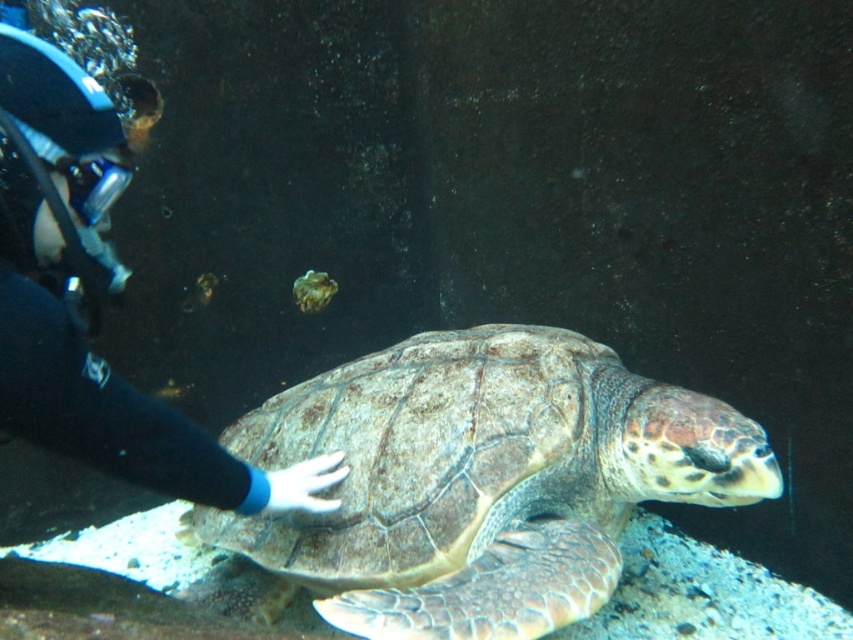
You are a marine biologist studying the movements of underwater creatures. You observe the leathery brown turtle at center in the image. Can you determine its exact coordinates in the frame?

The leathery brown turtle at center is located at coordinates point (480,481).

You are a marine biologist observing an underwater scene. You see the leathery brown turtle at center and the black rubber glove at lower left. Which object is wider?

The leathery brown turtle at center is wider than the black rubber glove at lower left.

You are a scuba diver who wants to take a photo of the sea turtle without disturbing it. You are currently at point (x=300, y=452). The turtle is 1.82 meters away from you. Is the turtle within the safe distance of 2 meters recommended for marine life interaction?

The turtle is 1.82 meters away from point (x=300, y=452), which is within the safe distance of 2 meters recommended for marine life interaction. You can take the photo without disturbing it.